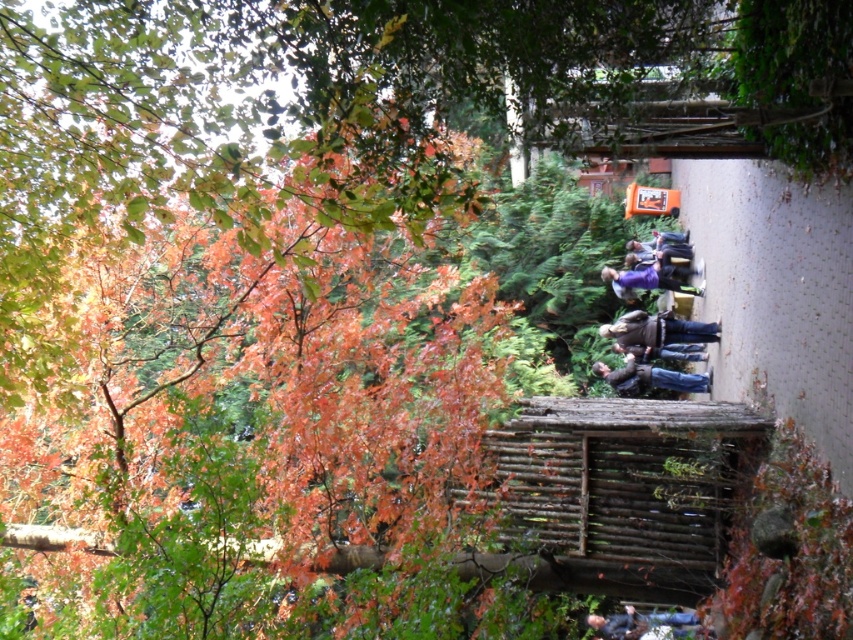
Question: Does blue jeans at center have a lesser width compared to purple fabric at center?

Choices:
 (A) yes
 (B) no

Answer: (A)

Question: Which point is closer to the camera?

Choices:
 (A) matte black jacket at lower center
 (B) blue jeans at center
 (C) dark blue jeans at center
 (D) purple fabric at center

Answer: (A)

Question: Which point is farther to the camera?

Choices:
 (A) matte black jacket at lower center
 (B) blue jeans at center

Answer: (B)

Question: Which is nearer to the blue jeans at center?

Choices:
 (A) matte black jacket at lower center
 (B) dark blue jeans at center

Answer: (B)

Question: Is purple fabric at center closer to camera compared to matte black jacket at lower center?

Choices:
 (A) yes
 (B) no

Answer: (B)

Question: Is purple fabric at center in front of matte black jacket at lower center?

Choices:
 (A) no
 (B) yes

Answer: (A)